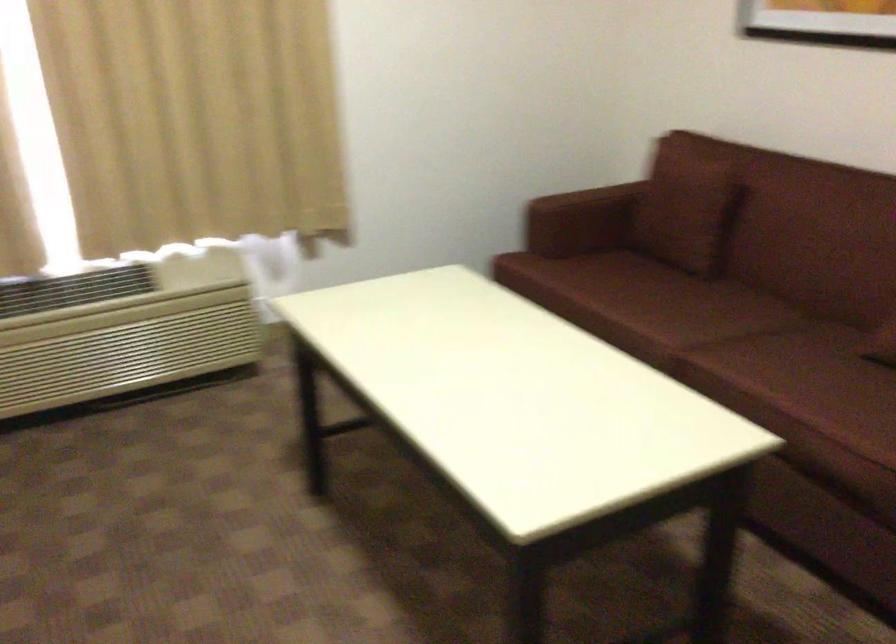
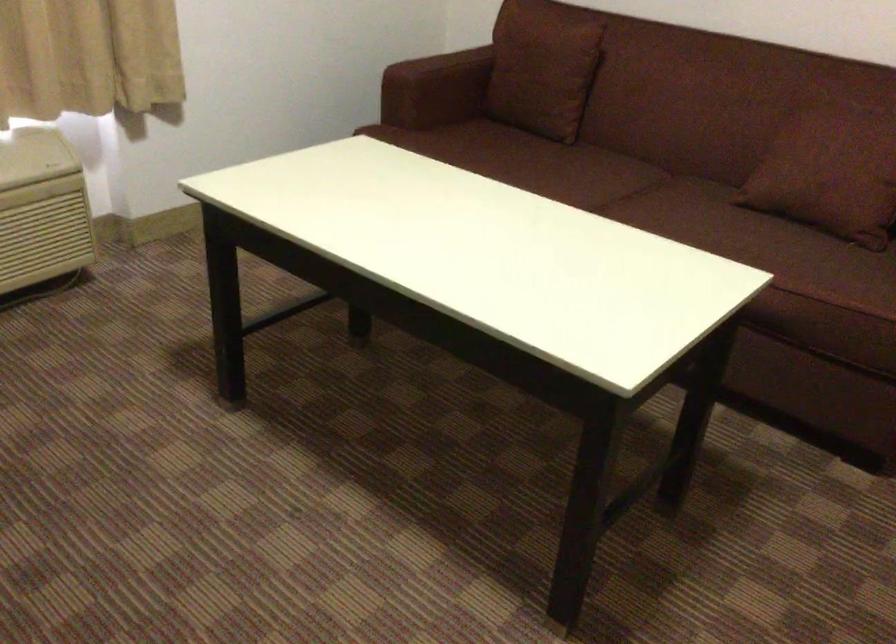
Where in the second image is the point corresponding to point 670,200 from the first image?

(543, 69)